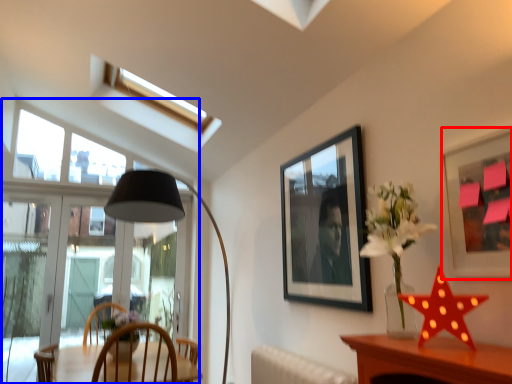
Question: Which of the following is the farthest to the observer, picture frame (highlighted by a red box) or window (highlighted by a blue box)?

Choices:
 (A) picture frame
 (B) window

Answer: (B)